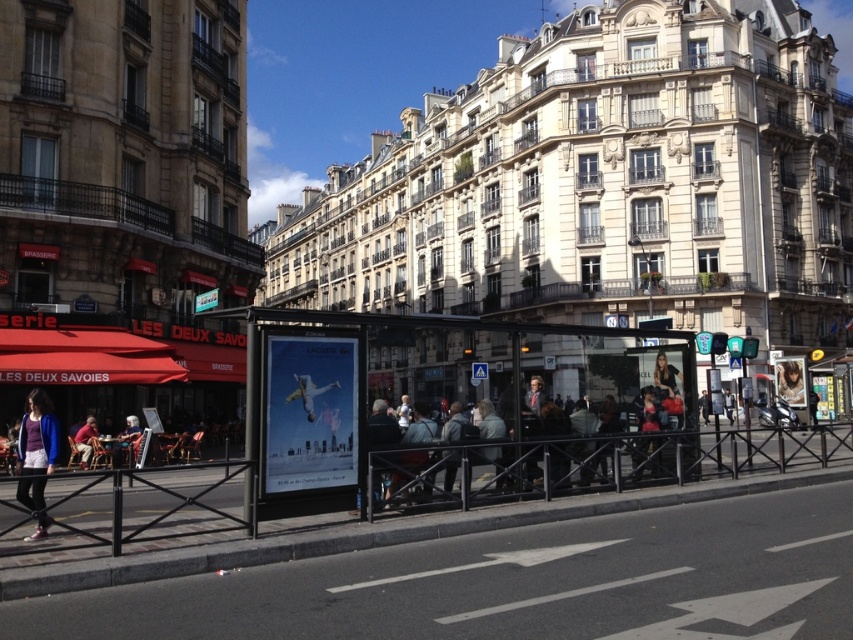
Question: Which object is farther from the camera taking this photo?

Choices:
 (A) metallic silver poster at center
 (B) matte black jacket at center

Answer: (A)

Question: Is matte black jacket at center thinner than matte white poster at center?

Choices:
 (A) yes
 (B) no

Answer: (B)

Question: Which is nearer to the transparent glass bus stop at center?

Choices:
 (A) matte blue sweater at lower left
 (B) dark blue jeans at center
 (C) matte black jacket at center

Answer: (C)

Question: Where is dark blue jeans at center located in relation to red fabric jacket at lower left in the image?

Choices:
 (A) right
 (B) left

Answer: (A)

Question: Does matte black jacket at center have a larger size compared to dark blue jeans at center?

Choices:
 (A) no
 (B) yes

Answer: (B)

Question: Among these points, which one is nearest to the camera?

Choices:
 (A) (299, 435)
 (B) (390, 492)
 (C) (456, 464)

Answer: (A)